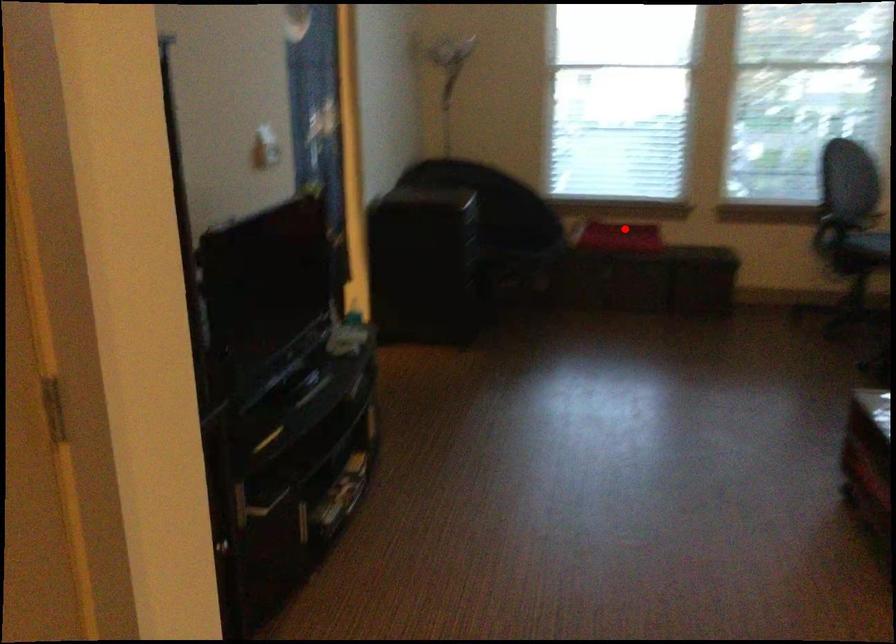
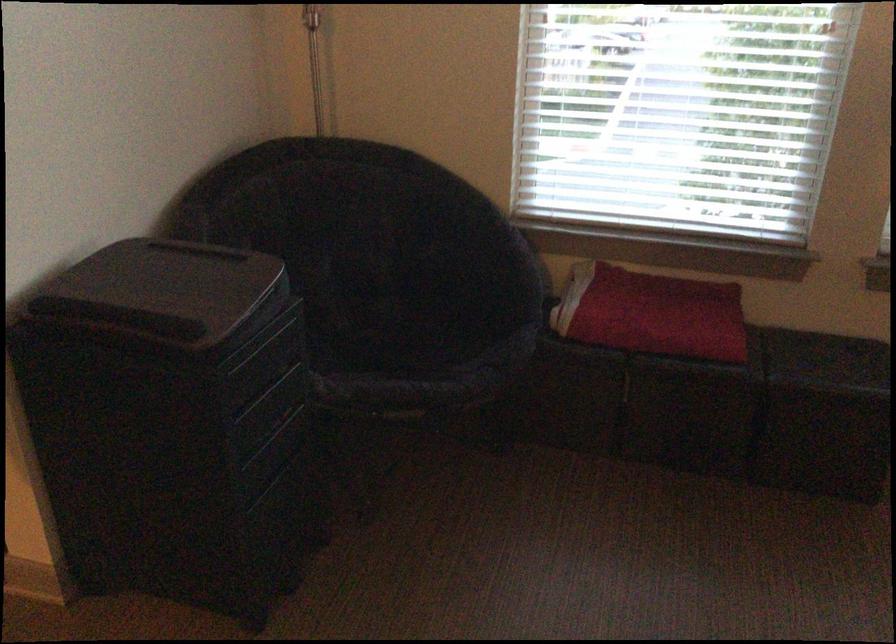
Where in the second image is the point corresponding to the highlighted location from the first image?

(651, 313)